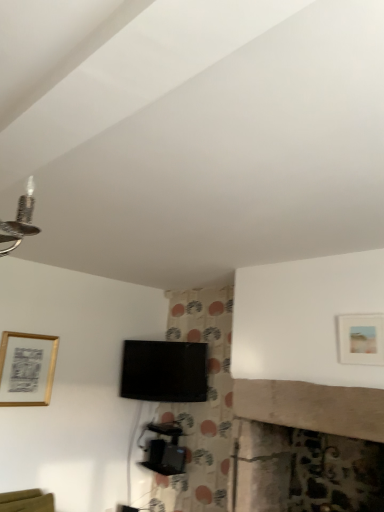
Question: Are matte gold picture frame at upper right, positioned as the 1th picture frame in right-to-left order, and black glossy tv at center far apart?

Choices:
 (A) yes
 (B) no

Answer: (A)

Question: Is black glossy tv at center at the back of matte gold picture frame at upper right, marked as the 1th picture frame in a top-to-bottom arrangement?

Choices:
 (A) no
 (B) yes

Answer: (A)

Question: From a real-world perspective, is matte gold picture frame at upper right, positioned as the 1th picture frame in right-to-left order, beneath black glossy tv at center?

Choices:
 (A) no
 (B) yes

Answer: (A)

Question: Considering the relative sizes of matte gold picture frame at upper right, marked as the 2th picture frame in a left-to-right arrangement, and black glossy tv at center in the image provided, is matte gold picture frame at upper right, marked as the 2th picture frame in a left-to-right arrangement, smaller than black glossy tv at center?

Choices:
 (A) yes
 (B) no

Answer: (A)

Question: Is matte gold picture frame at upper right, which appears as the first picture frame when viewed from the front, positioned behind black glossy tv at center?

Choices:
 (A) no
 (B) yes

Answer: (A)

Question: Is matte gold picture frame at upper right, which appears as the first picture frame when viewed from the front, in contact with black glossy tv at center?

Choices:
 (A) no
 (B) yes

Answer: (A)

Question: Considering the relative sizes of gold metallic picture frame at upper left, which is the second picture frame in right-to-left order, and black plastic tv stand at center in the image provided, is gold metallic picture frame at upper left, which is the second picture frame in right-to-left order, smaller than black plastic tv stand at center?

Choices:
 (A) yes
 (B) no

Answer: (A)

Question: Is black plastic tv stand at center a part of gold metallic picture frame at upper left, the 2th picture frame in the top-to-bottom sequence?

Choices:
 (A) yes
 (B) no

Answer: (B)

Question: Is gold metallic picture frame at upper left, marked as the 1th picture frame in a left-to-right arrangement, to the left of black plastic tv stand at center from the viewer's perspective?

Choices:
 (A) yes
 (B) no

Answer: (A)

Question: Does gold metallic picture frame at upper left, which is the second picture frame in right-to-left order, have a greater width compared to black plastic tv stand at center?

Choices:
 (A) yes
 (B) no

Answer: (B)

Question: Can you confirm if gold metallic picture frame at upper left, arranged as the first picture frame when viewed from the back, is shorter than black plastic tv stand at center?

Choices:
 (A) yes
 (B) no

Answer: (B)

Question: Would you say gold metallic picture frame at upper left, the second picture frame in the front-to-back sequence, is outside black plastic tv stand at center?

Choices:
 (A) no
 (B) yes

Answer: (B)

Question: Does gold metallic picture frame at upper left, the 2th picture frame in the top-to-bottom sequence, have a greater width compared to black glossy tv at center?

Choices:
 (A) yes
 (B) no

Answer: (B)